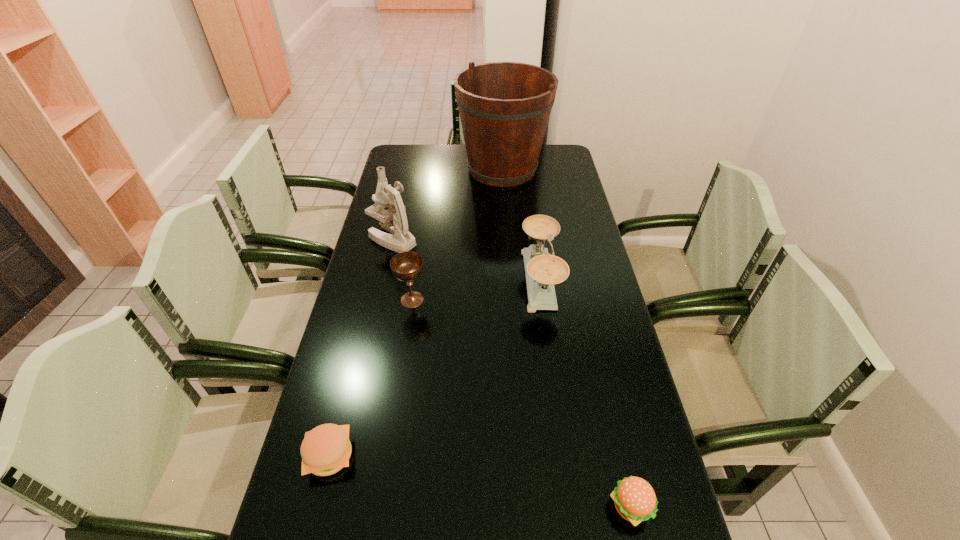
Identify the location of bucket. (504, 107).

The width and height of the screenshot is (960, 540). In order to click on the farthest object in this screenshot , I will do click(504, 107).

The height and width of the screenshot is (540, 960). Find the location of `microscope`. microscope is located at coordinates (394, 220).

Locate an element on the screen. This screenshot has height=540, width=960. scale is located at coordinates (543, 270).

Where is `chalice`? The image size is (960, 540). chalice is located at coordinates (407, 266).

The width and height of the screenshot is (960, 540). Find the location of `the left hamburger`. the left hamburger is located at coordinates (326, 449).

This screenshot has width=960, height=540. Identify the location of the fifth farthest object. (326, 449).

Where is `the nearer hamburger`? the nearer hamburger is located at coordinates (635, 500).

The height and width of the screenshot is (540, 960). Find the location of `the right hamburger`. the right hamburger is located at coordinates (635, 500).

I want to click on free space located on the front of the bucket, so click(505, 206).